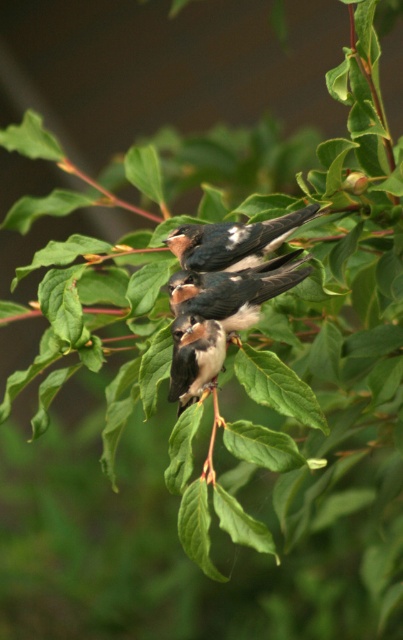
Question: Which of the following is the farthest from the observer?

Choices:
 (A) brown speckled feathers at center
 (B) speckled feathered swallow at center
 (C) brown feathered bird at center

Answer: (B)

Question: Can you confirm if brown feathered bird at center is positioned above brown speckled feathers at center?

Choices:
 (A) yes
 (B) no

Answer: (A)

Question: Does brown feathered bird at center come in front of speckled feathered swallow at center?

Choices:
 (A) yes
 (B) no

Answer: (A)

Question: Among these objects, which one is farthest from the camera?

Choices:
 (A) brown speckled feathers at center
 (B) speckled feathered swallow at center
 (C) brown feathered bird at center

Answer: (B)

Question: From the image, what is the correct spatial relationship of brown feathered bird at center in relation to brown speckled feathers at center?

Choices:
 (A) right
 (B) left

Answer: (A)

Question: Which object appears closest to the camera in this image?

Choices:
 (A) brown feathered bird at center
 (B) brown speckled feathers at center

Answer: (B)